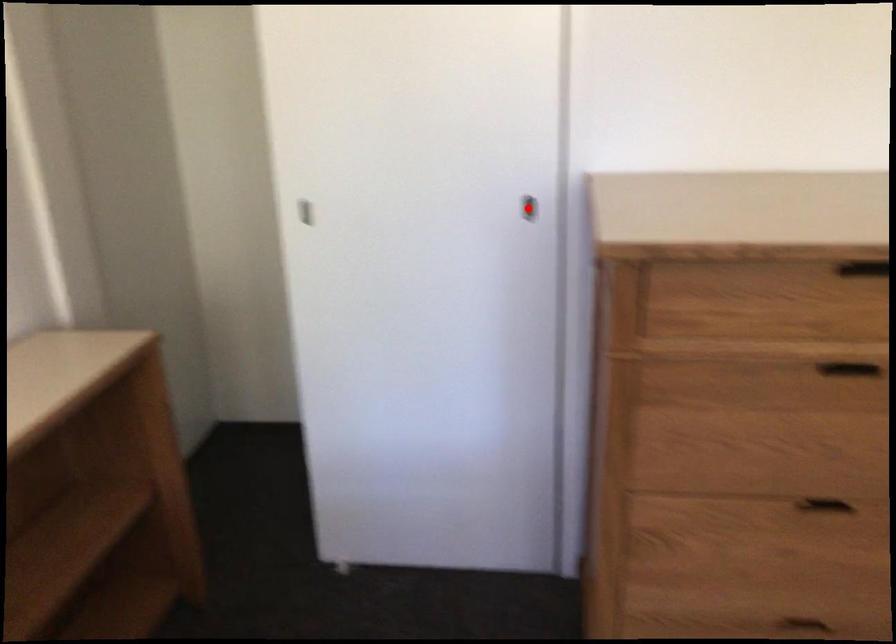
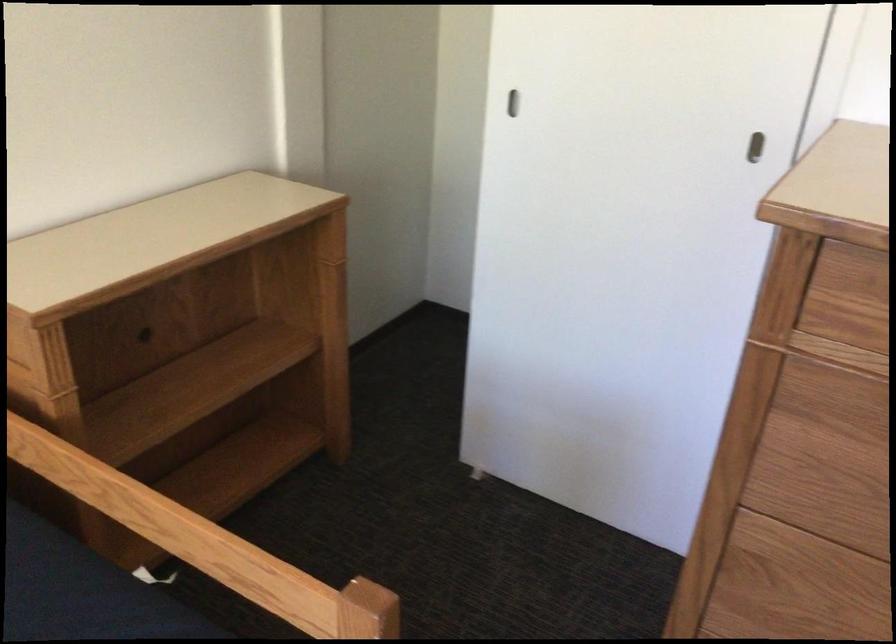
Find the pixel in the second image that matches the highlighted location in the first image.

(754, 147)